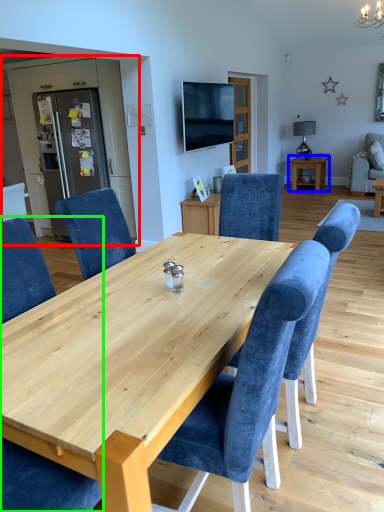
Question: Which object is the closest to the entertainment center (highlighted by a red box)? Choose among these: table (highlighted by a blue box) or chair (highlighted by a green box).

Choices:
 (A) table
 (B) chair

Answer: (A)